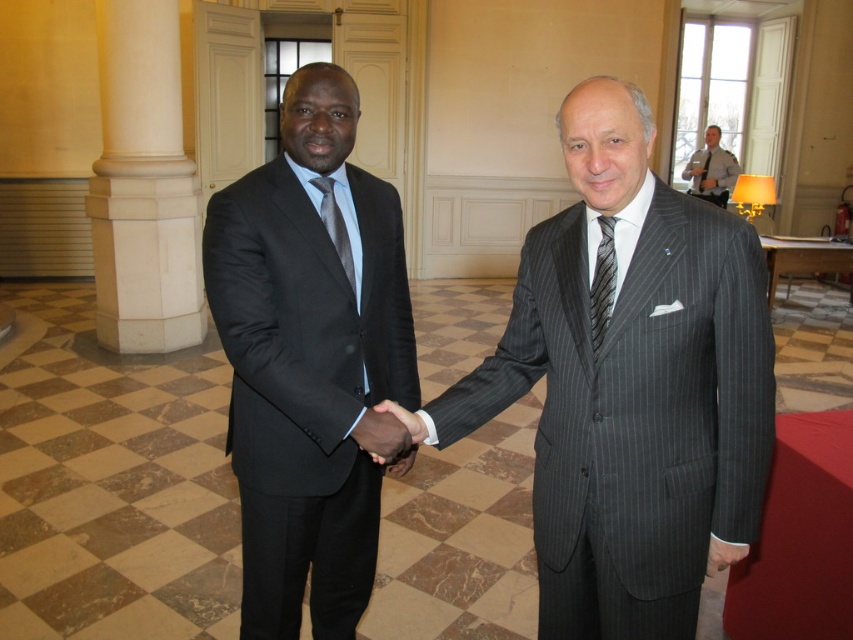
You are an event planner arranging a photo shoot in a conference room. You need to ensure that the matte black suit at center and the black silk hand at center are positioned so that the taller object is visible in the frame. Which object should be placed higher in the photo composition?

The matte black suit at center is taller than the black silk hand at center, so it should be placed higher in the photo composition to ensure visibility.

You are a photographer arranging a formal portrait. You have a matte black suit at center and a striped silk tie at center. Which item is wider?

The matte black suit at center is wider than the striped silk tie at center according to the description.

You are standing in the conference room and want to move from the column to the handshake between the two men. Which point, point (321,509) or point (610,253), is closer to you as you approach the handshake?

Point (321,509) is closer to you because it is further to the viewer than point (610,253). Since you are approaching the handshake, the point that is closer to your position would be the one that is nearer in depth, which in this case is the point further to the viewer.